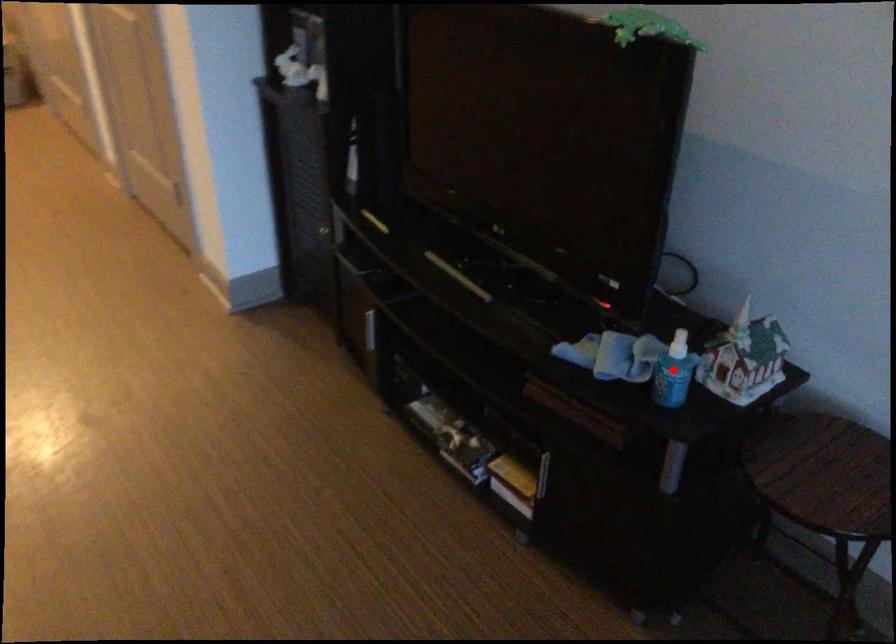
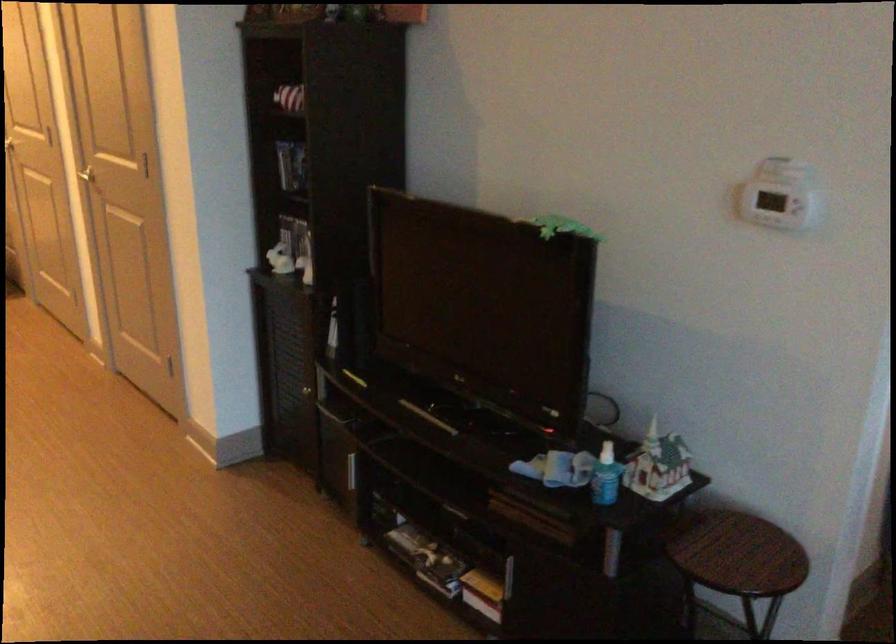
Question: I am providing you with two images of the same scene from different viewpoints. A red point is shown in image1. For the corresponding object point in image2, is it positioned nearer or farther from the camera?

Choices:
 (A) Nearer
 (B) Farther

Answer: (B)